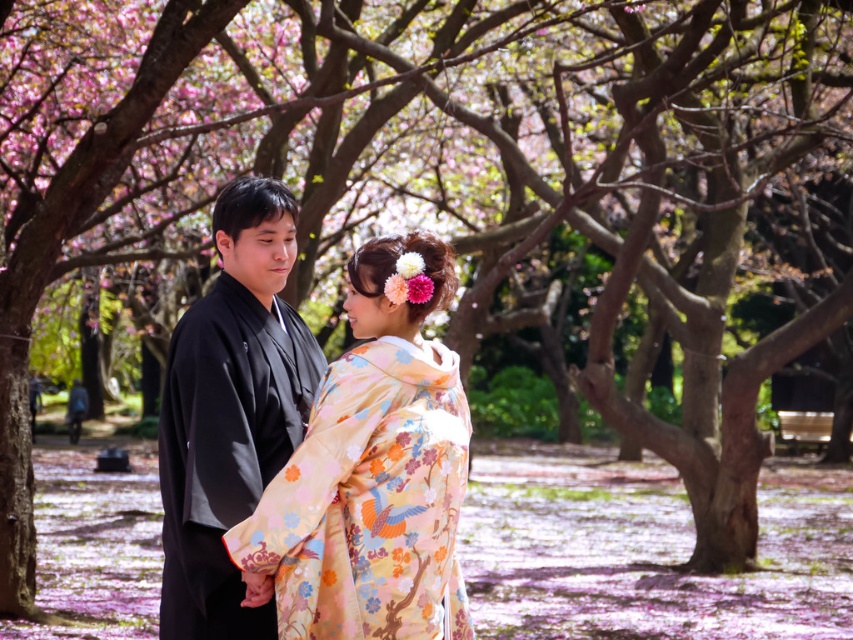
Can you confirm if floral silk kimono at center is smaller than black silk kimono at center?

Yes, floral silk kimono at center is smaller than black silk kimono at center.

Between floral silk kimono at center and black silk kimono at center, which one appears on the right side from the viewer's perspective?

floral silk kimono at center is more to the right.

The image size is (853, 640). Find the location of `floral silk kimono at center`. floral silk kimono at center is located at coordinates (370, 476).